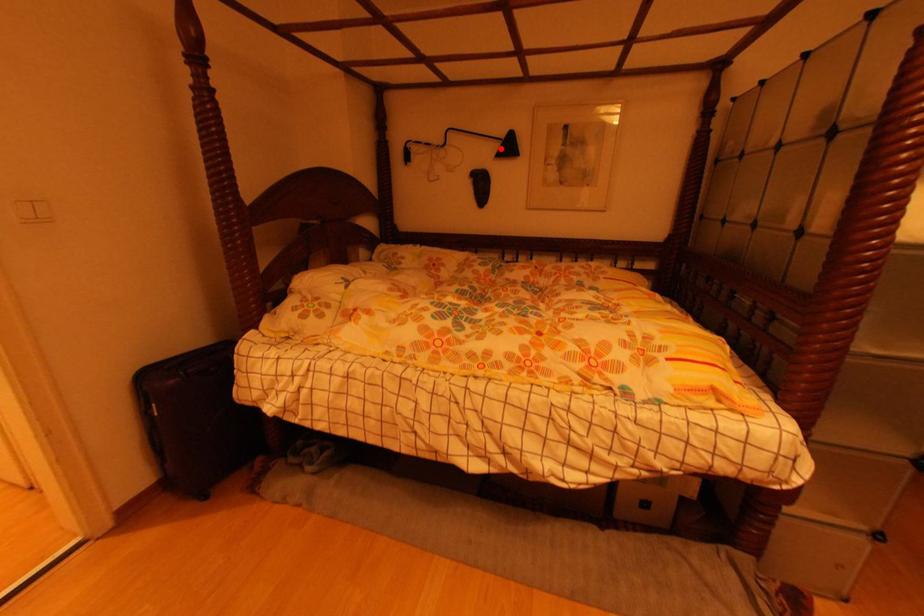
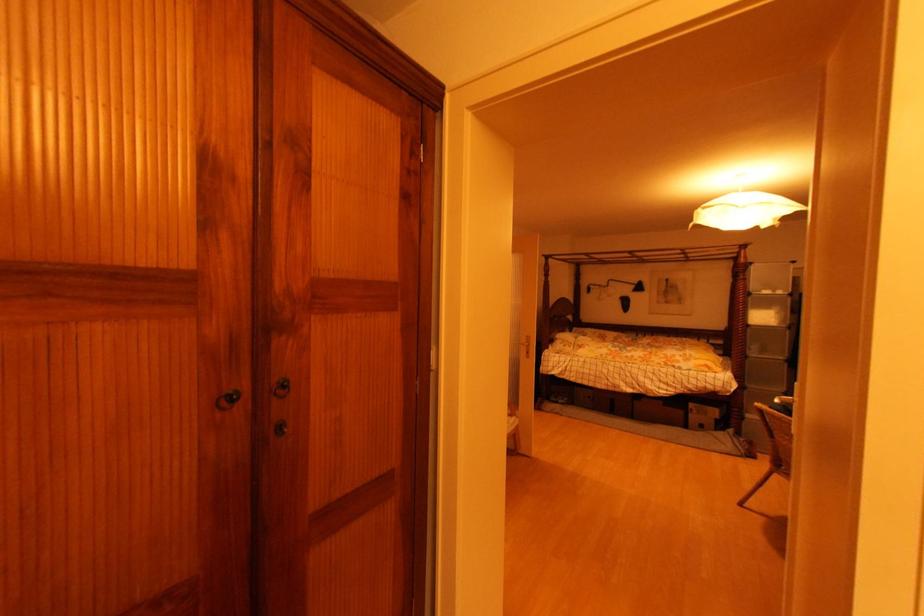
In the second image, find the point that corresponds to the highlighted location in the first image.

(638, 288)